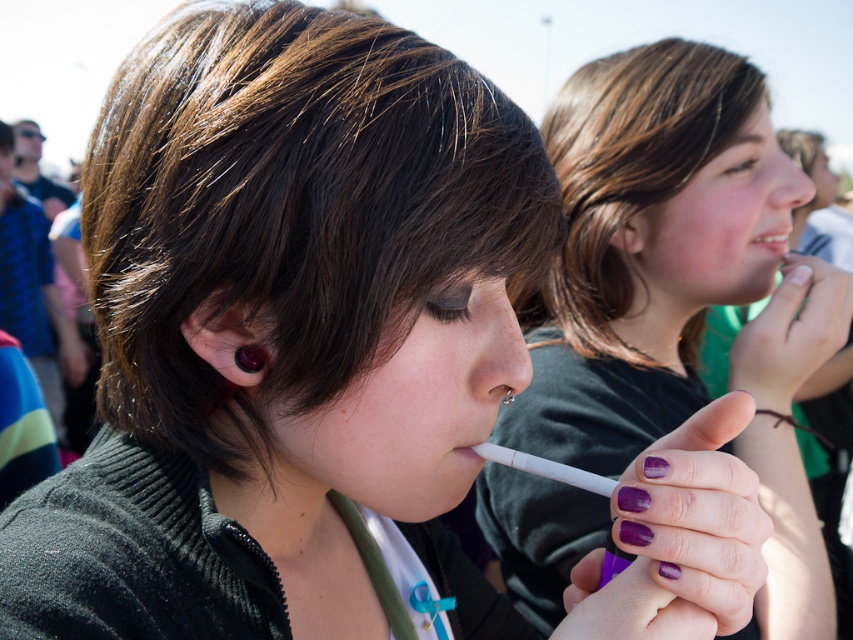
Can you confirm if white glossy teeth at upper center is thinner than purple matte lipstick at lower center?

No, white glossy teeth at upper center is not thinner than purple matte lipstick at lower center.

Is white glossy teeth at upper center further to camera compared to purple matte lipstick at lower center?

Yes, it is behind purple matte lipstick at lower center.

Between point (759, 240) and point (490, 449), which one is positioned behind?

Point (759, 240)

You are a GUI agent. You are given a task and a screenshot of the screen. Output one action in this format:
    pyautogui.click(x=<x>, y=<y>)
    Task: Click on the white glossy teeth at upper center
    The image size is (853, 640).
    Given the screenshot: What is the action you would take?
    pyautogui.click(x=770, y=237)

Between point (672, 298) and point (467, 452), which one is positioned in front?

Positioned in front is point (467, 452).

Between purple nail polish at center and purple matte lipstick at lower center, which one is positioned lower?

purple matte lipstick at lower center

From the picture: Who is more distant from viewer, (583, 426) or (466, 448)?

Point (583, 426)

At what (x,y) coordinates should I click in order to perform the action: click on purple nail polish at center. Please return your answer as a coordinate pair (x, y). Looking at the image, I should click on point(663,256).

Is purple nail polish at center further to the viewer compared to white glossy teeth at upper center?

No, it is not.

This screenshot has height=640, width=853. Identify the location of purple nail polish at center. (663, 256).

The image size is (853, 640). What are the coordinates of `purple nail polish at center` in the screenshot? It's located at (663, 256).